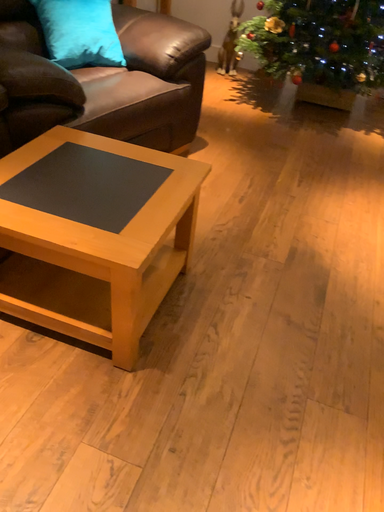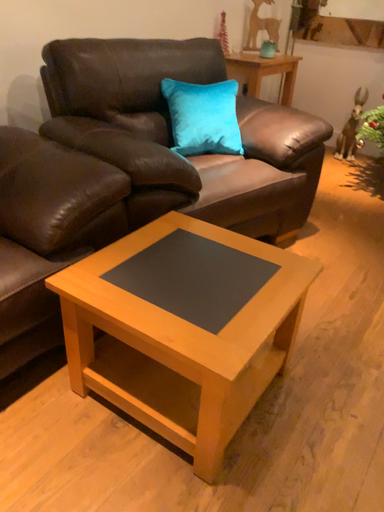
Question: How did the camera likely rotate when shooting the video?

Choices:
 (A) rotated right
 (B) rotated left

Answer: (B)